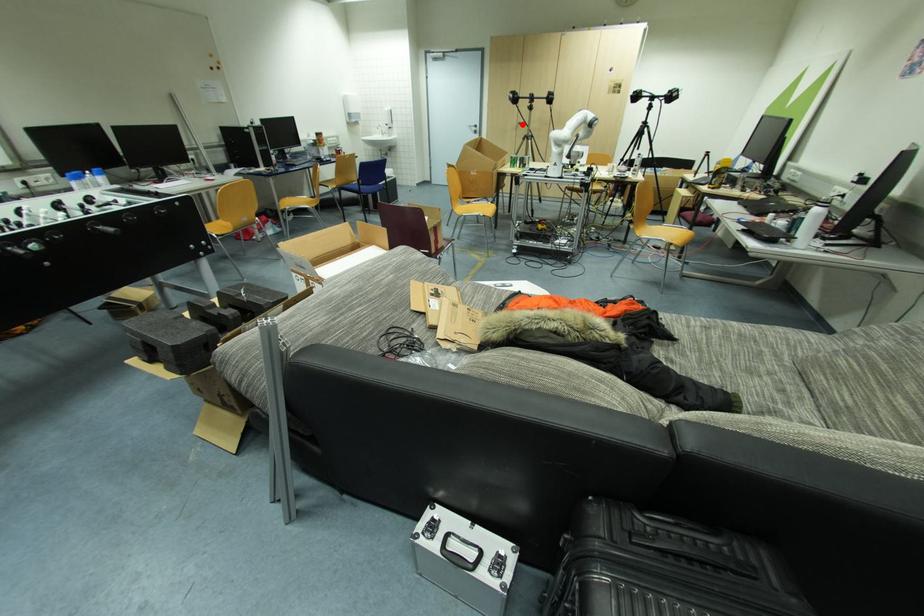
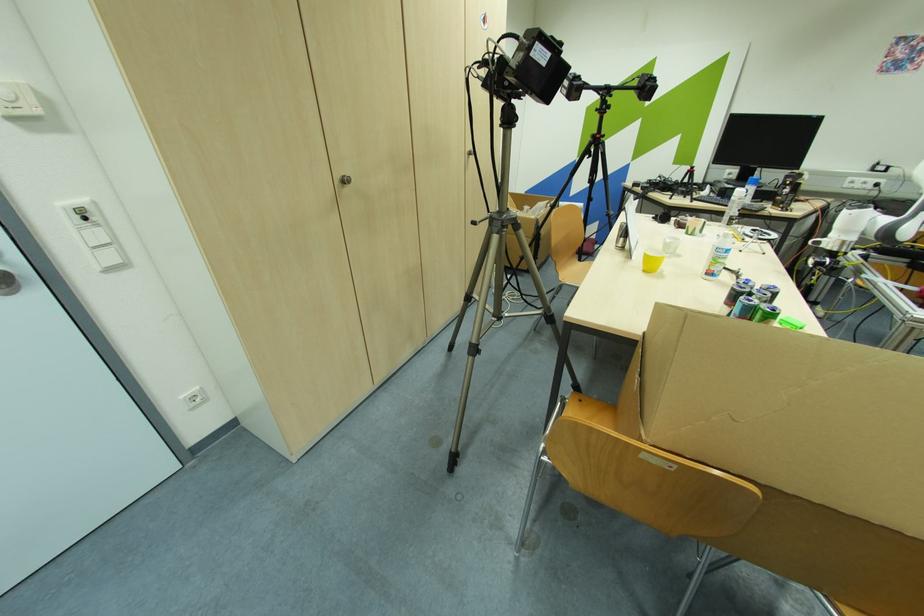
Locate, in the second image, the point that corresponds to the highlighted location in the first image.

(348, 182)